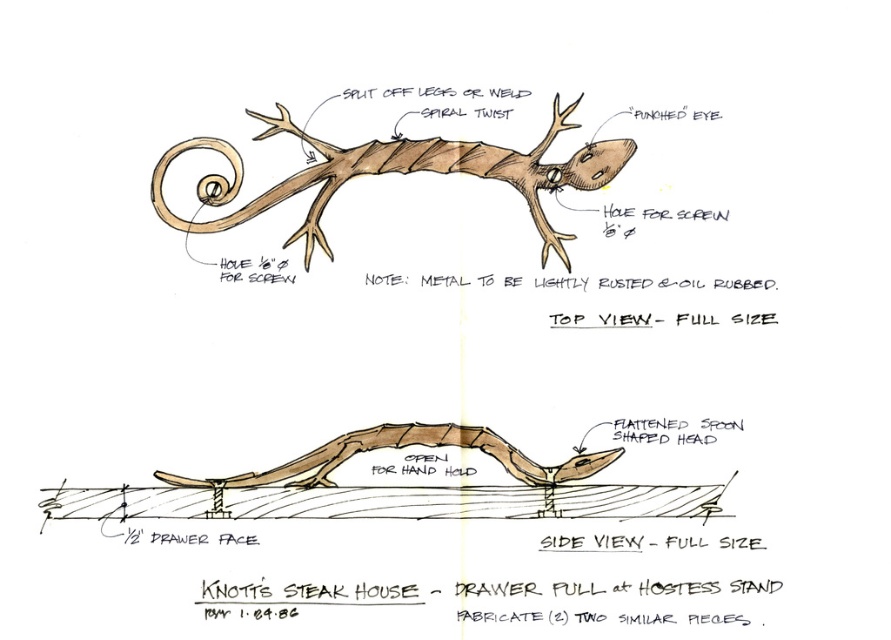
Question: Can you confirm if rustic metal lizard at center is thinner than brown matte wood lizard at center?

Choices:
 (A) yes
 (B) no

Answer: (B)

Question: Does rustic metal lizard at center lie in front of brown matte wood lizard at center?

Choices:
 (A) no
 (B) yes

Answer: (A)

Question: Can you confirm if rustic metal lizard at center is positioned above brown matte wood lizard at center?

Choices:
 (A) no
 (B) yes

Answer: (B)

Question: Among these objects, which one is farthest from the camera?

Choices:
 (A) brown matte wood lizard at center
 (B) rustic metal lizard at center

Answer: (B)

Question: Among these objects, which one is nearest to the camera?

Choices:
 (A) brown matte wood lizard at center
 (B) rustic metal lizard at center

Answer: (A)